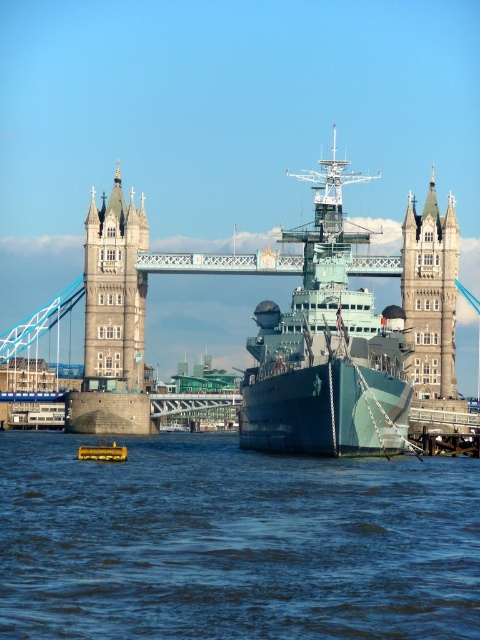
Question: Which of the following is the closest to the observer?

Choices:
 (A) teal matte battleship at center
 (B) yellow rubber boat at lower center
 (C) blue water at center
 (D) stone tower at left

Answer: (C)

Question: Does stone tower at center lie behind yellow rubber boat at lower center?

Choices:
 (A) yes
 (B) no

Answer: (A)

Question: Can you confirm if teal matte battleship at center is thinner than stone tower at left?

Choices:
 (A) no
 (B) yes

Answer: (A)

Question: Which point is closer to the camera taking this photo?

Choices:
 (A) (72, 424)
 (B) (450, 228)

Answer: (B)

Question: Is teal matte battleship at center in front of stone tower at left?

Choices:
 (A) yes
 (B) no

Answer: (A)

Question: Based on their relative distances, which object is farther from the stone tower at left?

Choices:
 (A) blue water at center
 (B) teal matte battleship at center
 (C) yellow rubber boat at lower center
 (D) stone tower at center

Answer: (D)